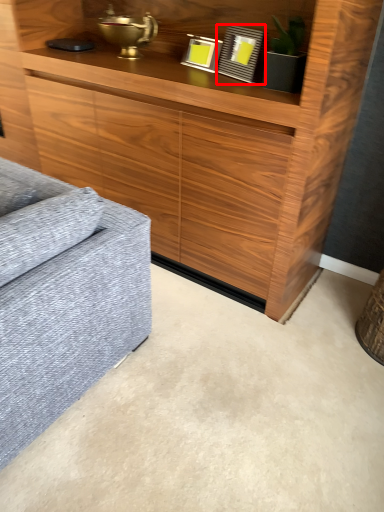
Question: From the image's perspective, what is the correct spatial positioning of picture frame (annotated by the red box) in reference to picture frame?

Choices:
 (A) below
 (B) above

Answer: (A)